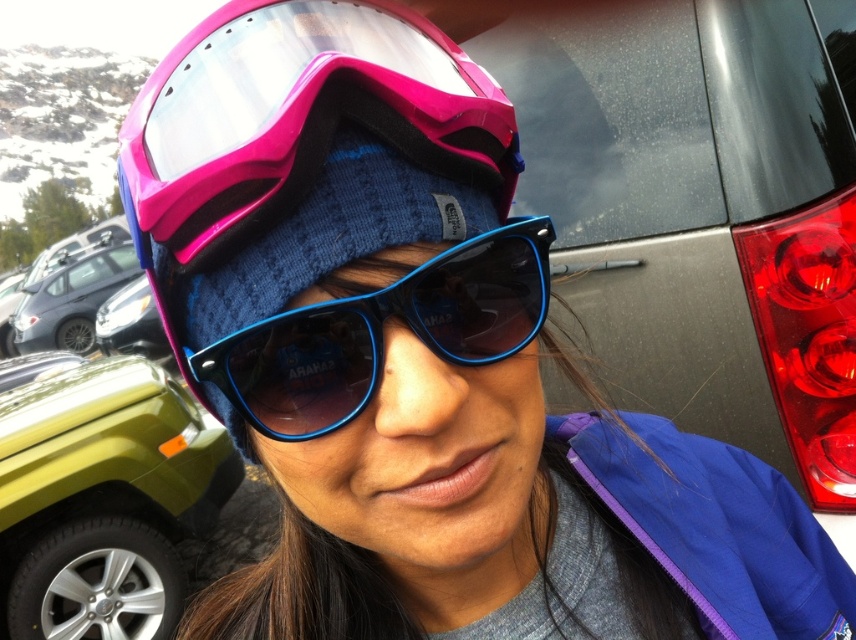
You are a photographer trying to capture the blue plastic sunglasses at center in your shot. However, the green matte jeep at lower left is blocking your view. Can you move the sunglasses forward to be in front of the jeep?

The blue plastic sunglasses at center is behind the green matte jeep at lower left, so moving the sunglasses forward would place them in front of the jeep, allowing you to capture them without obstruction.

You are standing in the parking lot and see the point at coordinates (103, 499). Which vehicle is that point located on?

The point at coordinates (103, 499) is on the green matte jeep at lower left.